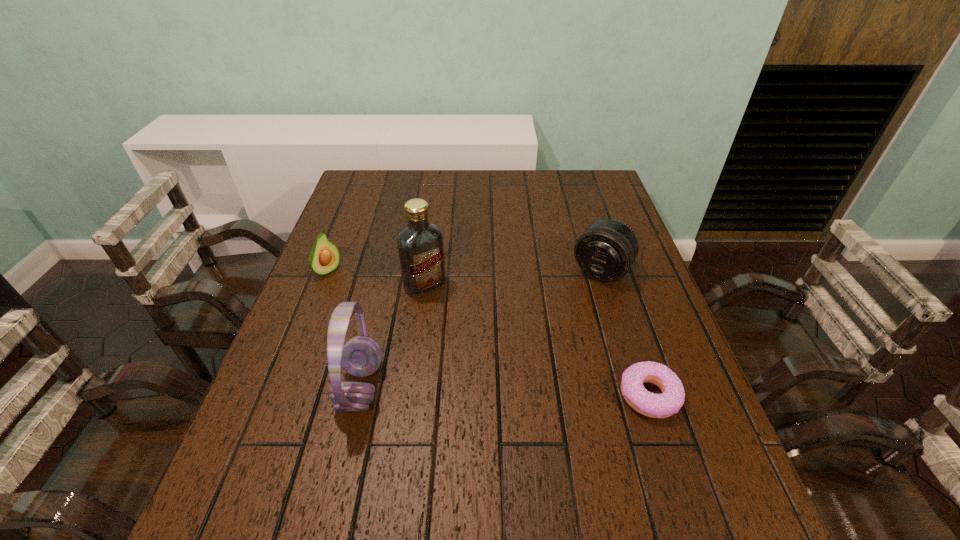
At what (x,y) coordinates should I click in order to perform the action: click on the second object from left to right. Please return your answer as a coordinate pair (x, y). This screenshot has height=540, width=960. Looking at the image, I should click on (361, 356).

This screenshot has height=540, width=960. I want to click on headset, so click(x=361, y=356).

Identify the location of the shortest object. This screenshot has height=540, width=960. (653, 405).

The width and height of the screenshot is (960, 540). What are the coordinates of `the third tallest object` in the screenshot? It's located at (606, 250).

At what (x,y) coordinates should I click in order to perform the action: click on the leftmost object. Please return your answer as a coordinate pair (x, y). The width and height of the screenshot is (960, 540). Looking at the image, I should click on (324, 258).

This screenshot has height=540, width=960. In order to click on the fourth tallest object in this screenshot , I will do point(324,258).

Find the location of a particular element. This screenshot has width=960, height=540. the tallest object is located at coordinates (420, 245).

Image resolution: width=960 pixels, height=540 pixels. Find the location of `the third object from right to left`. the third object from right to left is located at coordinates (420, 245).

What are the coordinates of `free space located on the headband and ear cups of the second object from left to right` in the screenshot? It's located at (284, 387).

This screenshot has height=540, width=960. Identify the location of free location located 0.070m on the headband and ear cups of the second object from left to right. (307, 387).